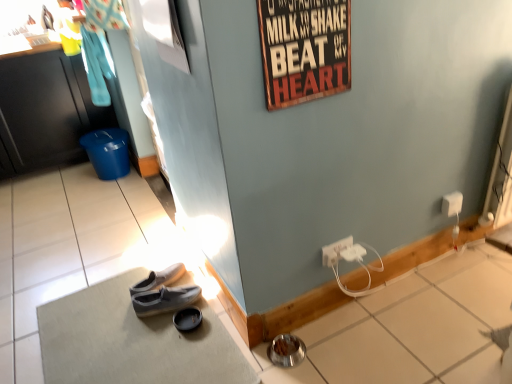
At what (x,y) coordinates should I click in order to perform the action: click on free point in front of matte gray shoe at center, which is counted as the 2th footwear, starting from the left. Please return your answer as a coordinate pair (x, y). The image size is (512, 384). Looking at the image, I should click on click(195, 362).